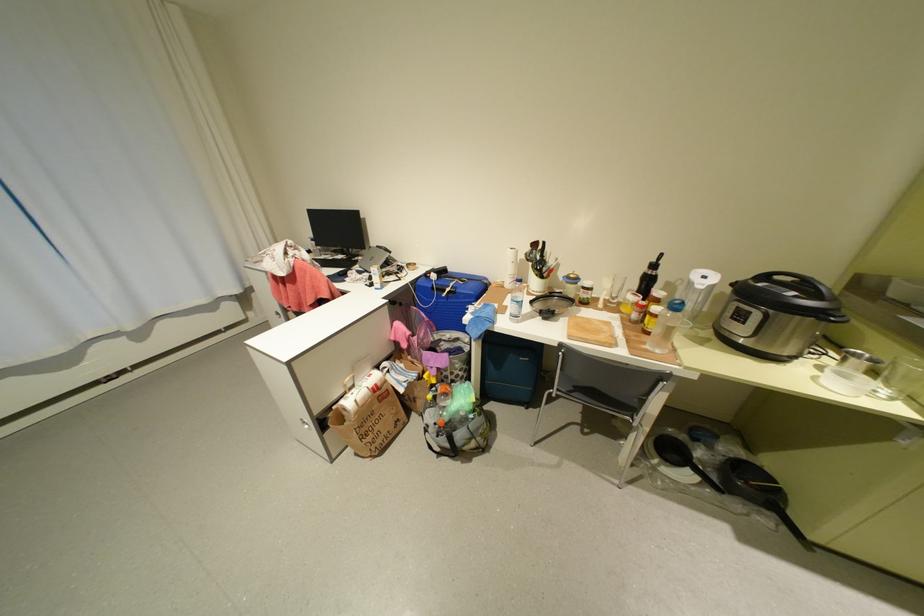
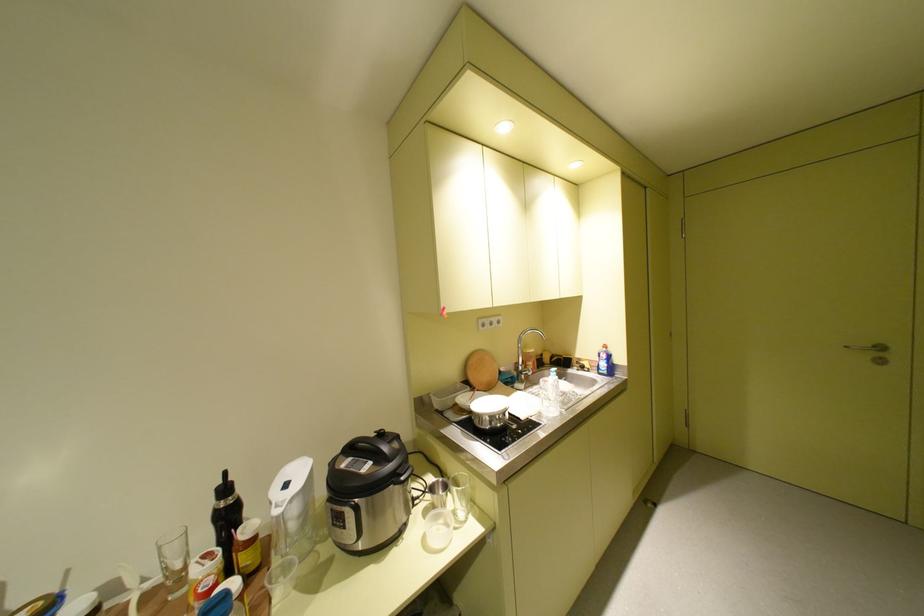
Find the pixel in the second image that matches [776,278] in the first image.

(361, 448)